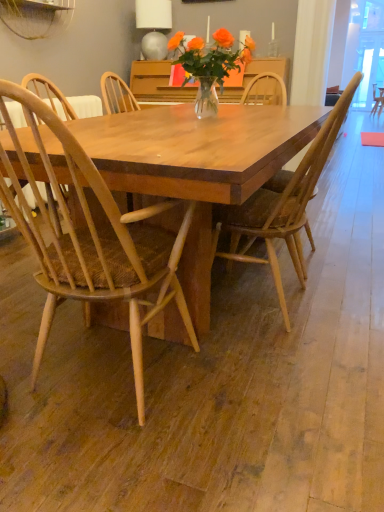
Question: In terms of width, does wooden chair at center, the 2th chair in the left-to-right sequence, look wider or thinner when compared to matte gray lampshade at upper center?

Choices:
 (A) wide
 (B) thin

Answer: (A)

Question: Would you say wooden chair at center, the 2th chair in the left-to-right sequence, is to the left or to the right of matte gray lampshade at upper center in the picture?

Choices:
 (A) left
 (B) right

Answer: (B)

Question: Considering the real-world distances, which object is closest to the matte gray lampshade at upper center?

Choices:
 (A) natural wood chair at center, which is counted as the 2th chair, starting from the right
 (B) wooden chair at center, the 2th chair in the left-to-right sequence

Answer: (B)

Question: Considering the real-world distances, which object is closest to the natural wood chair at center, which is counted as the 2th chair, starting from the right?

Choices:
 (A) matte gray lampshade at upper center
 (B) wooden chair at center, the 2th chair in the left-to-right sequence

Answer: (B)